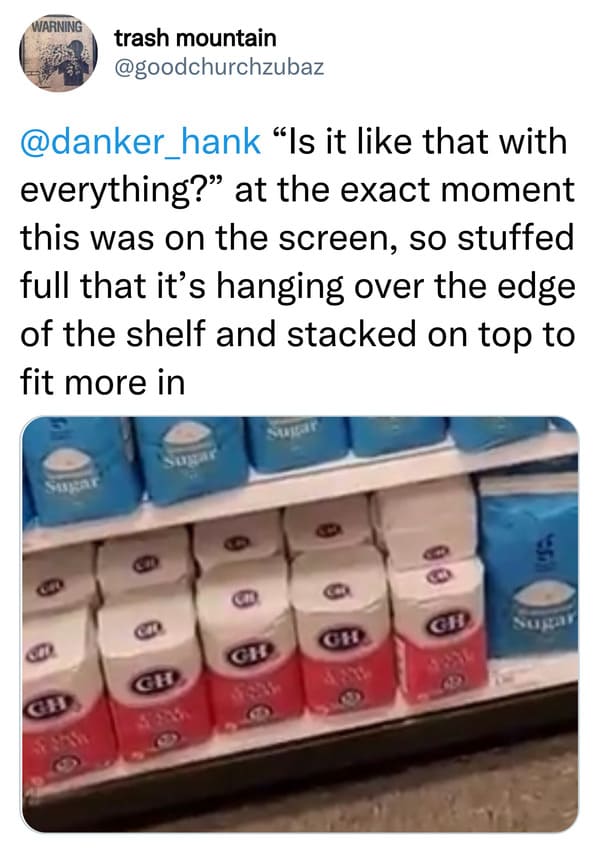
I want to click on black shelf, so click(x=344, y=746).